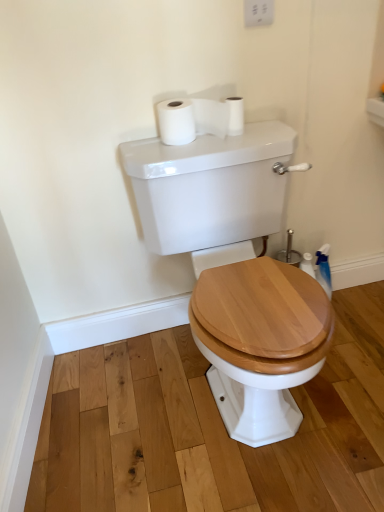
Question: Considering the relative positions of white plastic switch at upper center and white matte toilet paper at upper center, which ranks as the second toilet paper in left-to-right order, in the image provided, is white plastic switch at upper center to the right of white matte toilet paper at upper center, which ranks as the second toilet paper in left-to-right order, from the viewer's perspective?

Choices:
 (A) no
 (B) yes

Answer: (B)

Question: Does white plastic switch at upper center have a lesser height compared to white matte toilet paper at upper center, which ranks as the second toilet paper in left-to-right order?

Choices:
 (A) no
 (B) yes

Answer: (A)

Question: From the image's perspective, is white plastic switch at upper center under white matte toilet paper at upper center, placed as the 1th toilet paper when sorted from right to left?

Choices:
 (A) yes
 (B) no

Answer: (B)

Question: Is white plastic switch at upper center positioned with its back to white matte toilet paper at upper center, placed as the 1th toilet paper when sorted from right to left?

Choices:
 (A) yes
 (B) no

Answer: (B)

Question: From a real-world perspective, is white plastic switch at upper center located beneath white matte toilet paper at upper center, placed as the 1th toilet paper when sorted from right to left?

Choices:
 (A) no
 (B) yes

Answer: (A)

Question: Considering the positions of white plastic switch at upper center and white glossy porcelain at center in the image, is white plastic switch at upper center taller or shorter than white glossy porcelain at center?

Choices:
 (A) short
 (B) tall

Answer: (A)

Question: From a real-world perspective, is white plastic switch at upper center above or below white glossy porcelain at center?

Choices:
 (A) above
 (B) below

Answer: (A)

Question: Is white plastic switch at upper center in front of or behind white glossy porcelain at center in the image?

Choices:
 (A) front
 (B) behind

Answer: (B)

Question: From the image's perspective, is white plastic switch at upper center above or below white glossy porcelain at center?

Choices:
 (A) above
 (B) below

Answer: (A)

Question: From a real-world perspective, relative to white matte toilet paper at upper center, placed as the 1th toilet paper when sorted from right to left, is white matte toilet paper at upper center, which is the first toilet paper from left to right, vertically above or below?

Choices:
 (A) below
 (B) above

Answer: (B)

Question: Is white matte toilet paper at upper center, the second toilet paper in the right-to-left sequence, taller or shorter than white matte toilet paper at upper center, which ranks as the second toilet paper in left-to-right order?

Choices:
 (A) tall
 (B) short

Answer: (A)

Question: From the image's perspective, is white matte toilet paper at upper center, the second toilet paper in the right-to-left sequence, positioned above or below white matte toilet paper at upper center, placed as the 1th toilet paper when sorted from right to left?

Choices:
 (A) above
 (B) below

Answer: (B)

Question: Is white matte toilet paper at upper center, which is the first toilet paper from left to right, to the left or to the right of white matte toilet paper at upper center, placed as the 1th toilet paper when sorted from right to left, in the image?

Choices:
 (A) left
 (B) right

Answer: (A)

Question: Considering the positions of white glossy porcelain at center and white matte toilet paper at upper center, which is the first toilet paper from left to right, in the image, is white glossy porcelain at center bigger or smaller than white matte toilet paper at upper center, which is the first toilet paper from left to right,?

Choices:
 (A) big
 (B) small

Answer: (A)

Question: From a real-world perspective, is white glossy porcelain at center above or below white matte toilet paper at upper center, which is the first toilet paper from left to right?

Choices:
 (A) below
 (B) above

Answer: (A)